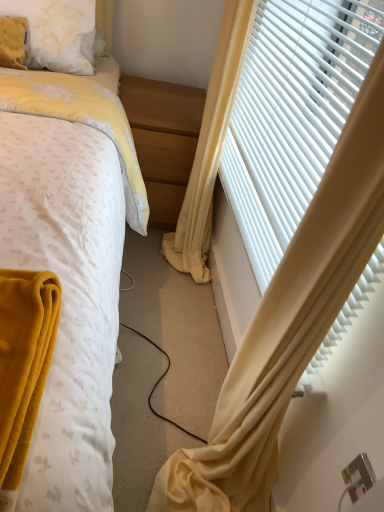
The height and width of the screenshot is (512, 384). Find the location of `yellow fabric curtain at right, which is the second curtain from right to left`. yellow fabric curtain at right, which is the second curtain from right to left is located at coordinates (294, 236).

From the picture: Measure the distance between silver metallic electric outlet at lower right and camera.

A distance of 62.60 centimeters exists between silver metallic electric outlet at lower right and camera.

What do you see at coordinates (210, 144) in the screenshot? I see `yellow fabric curtain at right, marked as the 1th curtain in a right-to-left arrangement` at bounding box center [210, 144].

Image resolution: width=384 pixels, height=512 pixels. Find the location of `yellow fabric curtain at right, marked as the 1th curtain in a right-to-left arrangement`. yellow fabric curtain at right, marked as the 1th curtain in a right-to-left arrangement is located at coordinates tap(210, 144).

Identify the location of yellow fabric curtain at right, which is the second curtain from right to left. (294, 236).

Is yellow fabric curtain at right, which is the second curtain from right to left, oriented towards white plastic blinds at right?

No, yellow fabric curtain at right, which is the second curtain from right to left, is not oriented towards white plastic blinds at right.

Considering the points (244, 82) and (342, 27), which point is in front, point (244, 82) or point (342, 27)?

The point (342, 27) is closer to the camera.

Is yellow fabric curtain at right, which is the second curtain from right to left, to the left of white plastic blinds at right from the viewer's perspective?

Yes.

Is white plastic blinds at right positioned far away from light wood/finely finished nightstand at center?

No, white plastic blinds at right is not far away from light wood/finely finished nightstand at center.

How many degrees apart are the facing directions of white plastic blinds at right and light wood/finely finished nightstand at center?

The angle between the facing direction of white plastic blinds at right and the facing direction of light wood/finely finished nightstand at center is 90 degrees.

Considering their positions, is white plastic blinds at right located in front of or behind light wood/finely finished nightstand at center?

white plastic blinds at right is in front of light wood/finely finished nightstand at center.

Is white plastic blinds at right positioned with its back to light wood/finely finished nightstand at center?

No, light wood/finely finished nightstand at center is not at the back of white plastic blinds at right.

Is fluffy white pillow at upper left not inside white plastic blinds at right?

Absolutely, fluffy white pillow at upper left is external to white plastic blinds at right.

Which is in front, point (62, 0) or point (274, 134)?

Positioned in front is point (274, 134).

Does fluffy white pillow at upper left come behind white plastic blinds at right?

That is True.

Is fluffy white pillow at upper left positioned far away from white plastic blinds at right?

No, fluffy white pillow at upper left is not far from white plastic blinds at right.

How many degrees apart are the facing directions of yellow fabric curtain at right, the 1th curtain positioned from the left, and fluffy white pillow at upper left?

4.13 degrees separate the facing orientations of yellow fabric curtain at right, the 1th curtain positioned from the left, and fluffy white pillow at upper left.

From the picture: How much distance is there between yellow fabric curtain at right, the 1th curtain positioned from the left, and fluffy white pillow at upper left?

The distance of yellow fabric curtain at right, the 1th curtain positioned from the left, from fluffy white pillow at upper left is 29.10 inches.

Can you confirm if yellow fabric curtain at right, the 1th curtain positioned from the left, is positioned to the right of fluffy white pillow at upper left?

Indeed, yellow fabric curtain at right, the 1th curtain positioned from the left, is positioned on the right side of fluffy white pillow at upper left.

Is yellow fabric curtain at right, the 1th curtain positioned from the left, touching fluffy white pillow at upper left?

No, yellow fabric curtain at right, the 1th curtain positioned from the left, is not touching fluffy white pillow at upper left.

The image size is (384, 512). I want to click on electric outlet on the right of yellow fabric curtain at right, the 2th curtain positioned from the left, so click(358, 477).

Is the depth of silver metallic electric outlet at lower right less than that of yellow fabric curtain at right, marked as the 1th curtain in a right-to-left arrangement?

Yes, it is.

Is silver metallic electric outlet at lower right oriented away from yellow fabric curtain at right, the 2th curtain positioned from the left?

That's not correct — silver metallic electric outlet at lower right is not looking away from yellow fabric curtain at right, the 2th curtain positioned from the left.

From the image's perspective, would you say silver metallic electric outlet at lower right is shown under light wood/finely finished nightstand at center?

Indeed, from the image's perspective, silver metallic electric outlet at lower right is shown beneath light wood/finely finished nightstand at center.

Is silver metallic electric outlet at lower right far away from light wood/finely finished nightstand at center?

silver metallic electric outlet at lower right is far away from light wood/finely finished nightstand at center.

Is silver metallic electric outlet at lower right facing away from light wood/finely finished nightstand at center?

That's not correct — silver metallic electric outlet at lower right is not looking away from light wood/finely finished nightstand at center.

Can you tell me how much silver metallic electric outlet at lower right and light wood/finely finished nightstand at center differ in facing direction?

The facing directions of silver metallic electric outlet at lower right and light wood/finely finished nightstand at center are 90 degrees apart.

Who is bigger, light wood/finely finished nightstand at center or silver metallic electric outlet at lower right?

With larger size is light wood/finely finished nightstand at center.

Considering the relative positions of light wood/finely finished nightstand at center and silver metallic electric outlet at lower right in the image provided, is light wood/finely finished nightstand at center to the right of silver metallic electric outlet at lower right from the viewer's perspective?

In fact, light wood/finely finished nightstand at center is to the left of silver metallic electric outlet at lower right.

Looking at this image, how many degrees apart are the facing directions of light wood/finely finished nightstand at center and silver metallic electric outlet at lower right?

They differ by 90 degrees in their facing directions.

Can you confirm if light wood/finely finished nightstand at center is shorter than silver metallic electric outlet at lower right?

No, light wood/finely finished nightstand at center is not shorter than silver metallic electric outlet at lower right.

Identify the location of window blind behind the yellow fabric curtain at right, which is the second curtain from right to left. (292, 114).

Locate an element on the screen. Image resolution: width=384 pixels, height=512 pixels. nightstand lying above the white plastic blinds at right (from the image's perspective) is located at coordinates (163, 140).

Estimate the real-world distances between objects in this image. Which object is further from yellow fabric curtain at right, which is the second curtain from right to left, white plastic blinds at right or silver metallic electric outlet at lower right?

silver metallic electric outlet at lower right is positioned further to the anchor yellow fabric curtain at right, which is the second curtain from right to left.

Based on their spatial positions, is light wood/finely finished nightstand at center or white plastic blinds at right closer to silver metallic electric outlet at lower right?

white plastic blinds at right.

Based on their spatial positions, is yellow fabric curtain at right, which is the second curtain from right to left, or yellow fabric curtain at right, marked as the 1th curtain in a right-to-left arrangement, further from fluffy white pillow at upper left?

yellow fabric curtain at right, which is the second curtain from right to left, is positioned further to the anchor fluffy white pillow at upper left.

Considering their positions, is fluffy white pillow at upper left positioned closer to white plastic blinds at right than silver metallic electric outlet at lower right?

The object closer to white plastic blinds at right is fluffy white pillow at upper left.

When comparing their distances from silver metallic electric outlet at lower right, does white plastic blinds at right or fluffy white pillow at upper left seem further?

fluffy white pillow at upper left is further to silver metallic electric outlet at lower right.

When comparing their distances from light wood/finely finished nightstand at center, does fluffy white pillow at upper left or yellow fabric curtain at right, the 1th curtain positioned from the left, seem closer?

The object closer to light wood/finely finished nightstand at center is fluffy white pillow at upper left.

Looking at this image, when comparing their distances from white plastic blinds at right, does yellow fabric curtain at right, which is the second curtain from right to left, or fluffy white pillow at upper left seem closer?

yellow fabric curtain at right, which is the second curtain from right to left, is positioned closer to the anchor white plastic blinds at right.

Looking at the image, which one is located closer to light wood/finely finished nightstand at center, silver metallic electric outlet at lower right or fluffy white pillow at upper left?

fluffy white pillow at upper left.

Find the location of `curtain between yellow fabric curtain at right, the 1th curtain positioned from the left, and fluffy white pillow at upper left in the front-back direction`. curtain between yellow fabric curtain at right, the 1th curtain positioned from the left, and fluffy white pillow at upper left in the front-back direction is located at coordinates (210, 144).

The image size is (384, 512). In order to click on window blind between yellow fabric curtain at right, the 1th curtain positioned from the left, and fluffy white pillow at upper left from front to back in this screenshot , I will do `click(292, 114)`.

At what (x,y) coordinates should I click in order to perform the action: click on pillow positioned between white plastic blinds at right and light wood/finely finished nightstand at center from near to far. Please return your answer as a coordinate pair (x, y). Looking at the image, I should click on (57, 33).

Find the location of a particular element. The width and height of the screenshot is (384, 512). window blind between yellow fabric curtain at right, the 1th curtain positioned from the left, and light wood/finely finished nightstand at center from front to back is located at coordinates (292, 114).